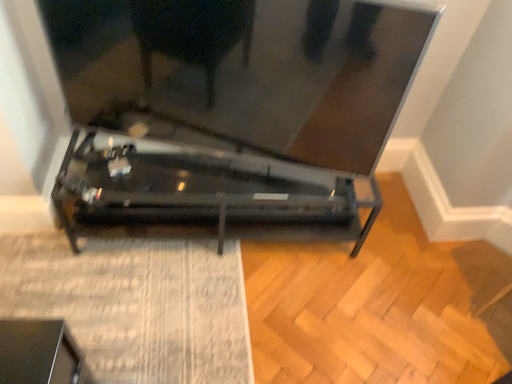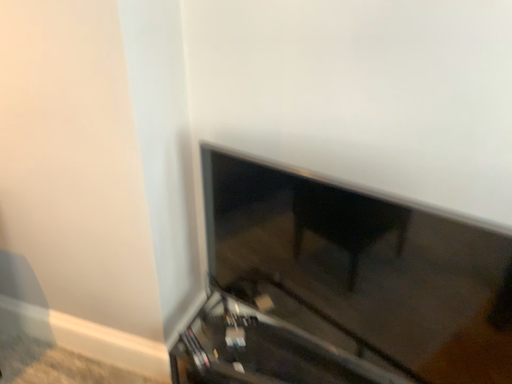
Question: How did the camera likely rotate when shooting the video?

Choices:
 (A) rotated right
 (B) rotated left

Answer: (B)